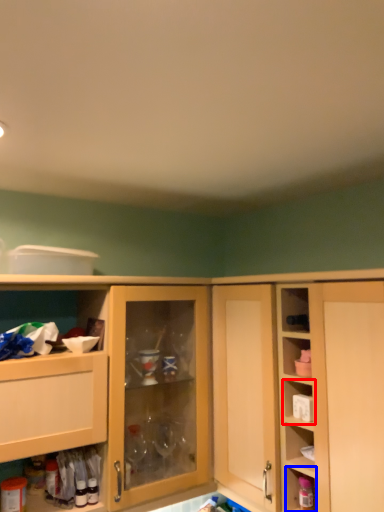
Question: Which object appears farthest to the camera in this image, shelf (highlighted by a red box) or cabinet (highlighted by a blue box)?

Choices:
 (A) shelf
 (B) cabinet

Answer: (A)